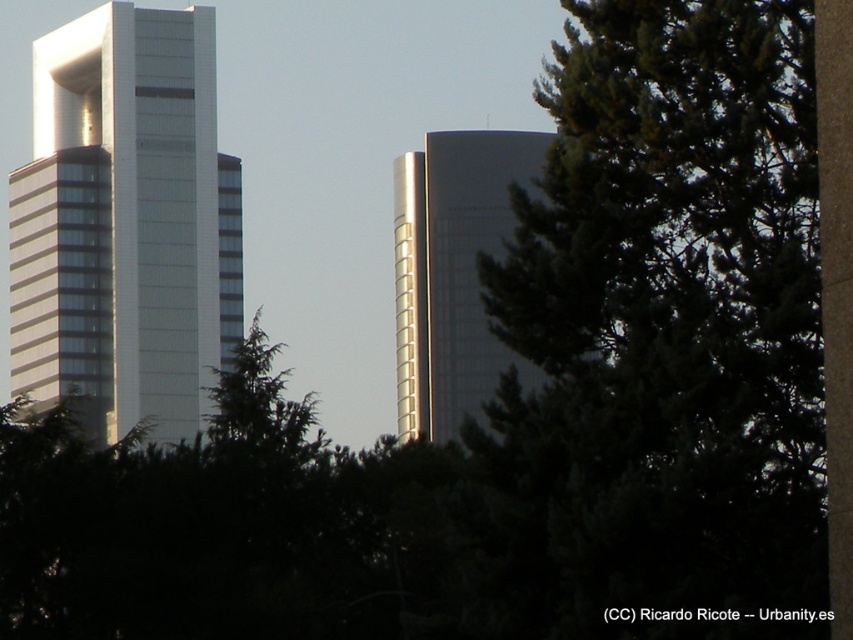
Is point (135, 356) positioned in front of point (428, 364)?

Yes.

Which of these two, white glass building at left or glossy glass tower at center, stands taller?

Standing taller between the two is white glass building at left.

Is point (99, 337) less distant than point (413, 372)?

Yes, it is in front of point (413, 372).

Identify the location of white glass building at left. The height and width of the screenshot is (640, 853). (125, 225).

Which is behind, point (723, 272) or point (517, 176)?

The point (517, 176) is more distant.

Image resolution: width=853 pixels, height=640 pixels. What do you see at coordinates (660, 336) in the screenshot?
I see `green textured tree at center` at bounding box center [660, 336].

Locate an element on the screen. green textured tree at center is located at coordinates (660, 336).

Where is `green textured tree at center`? green textured tree at center is located at coordinates (660, 336).

Is green textured tree at center taller than white glass building at left?

In fact, green textured tree at center may be shorter than white glass building at left.

Is green textured tree at center bigger than white glass building at left?

No.

This screenshot has width=853, height=640. I want to click on green textured tree at center, so click(x=660, y=336).

At what (x,y) coordinates should I click in order to perform the action: click on green textured tree at center. Please return your answer as a coordinate pair (x, y). The image size is (853, 640). Looking at the image, I should click on (660, 336).